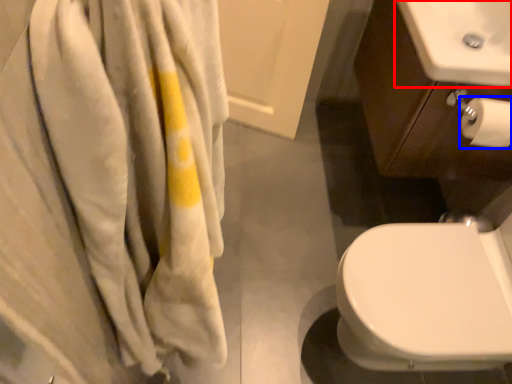
Question: Which point is closer to the camera, sink (highlighted by a red box) or toilet paper (highlighted by a blue box)?

Choices:
 (A) sink
 (B) toilet paper

Answer: (A)